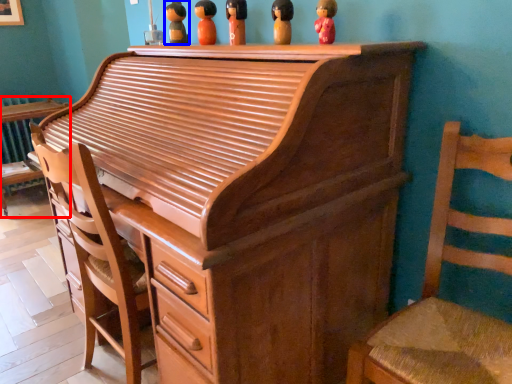
Question: Which point is further to the camera, furniture (highlighted by a red box) or toy (highlighted by a blue box)?

Choices:
 (A) furniture
 (B) toy

Answer: (A)